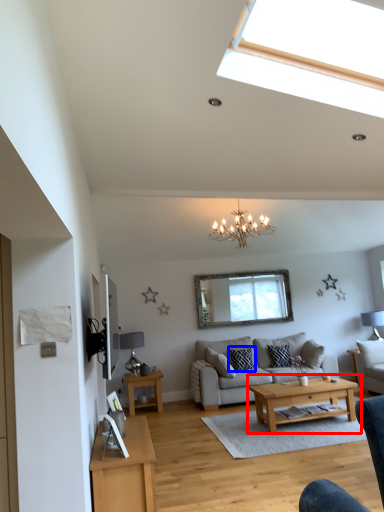
Question: Which object is closer to the camera taking this photo, coffee table (highlighted by a red box) or pillow (highlighted by a blue box)?

Choices:
 (A) coffee table
 (B) pillow

Answer: (A)